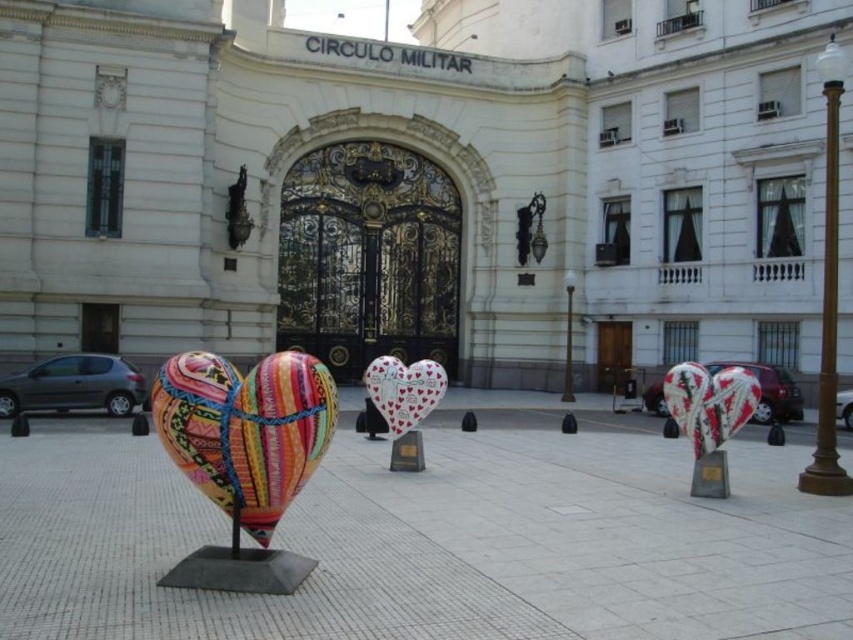
Which is above, textured fabric heart at center or white glossy heart at center?

Positioned higher is textured fabric heart at center.

Is point (706, 372) closer to camera compared to point (438, 381)?

Yes, point (706, 372) is closer to viewer.

I want to click on textured fabric heart at center, so click(x=709, y=403).

Can you confirm if white glossy heart at center is shorter than polished bronze statue at upper left?

Yes.

Is white glossy heart at center thinner than polished bronze statue at upper left?

Incorrect, white glossy heart at center's width is not less than polished bronze statue at upper left's.

Image resolution: width=853 pixels, height=640 pixels. I want to click on white glossy heart at center, so click(x=404, y=390).

Between brightly painted fabric heart at center and polished bronze statue at upper left, which one is positioned lower?

brightly painted fabric heart at center is below.

Who is more forward, (161, 426) or (236, 212)?

Point (161, 426)

From the picture: Who is more distant from viewer, (300,444) or (242,186)?

Point (242,186)

You are a GUI agent. You are given a task and a screenshot of the screen. Output one action in this format:
    pyautogui.click(x=<x>, y=<y>)
    Task: Click on the brightly painted fabric heart at center
    
    Given the screenshot: What is the action you would take?
    pyautogui.click(x=245, y=429)